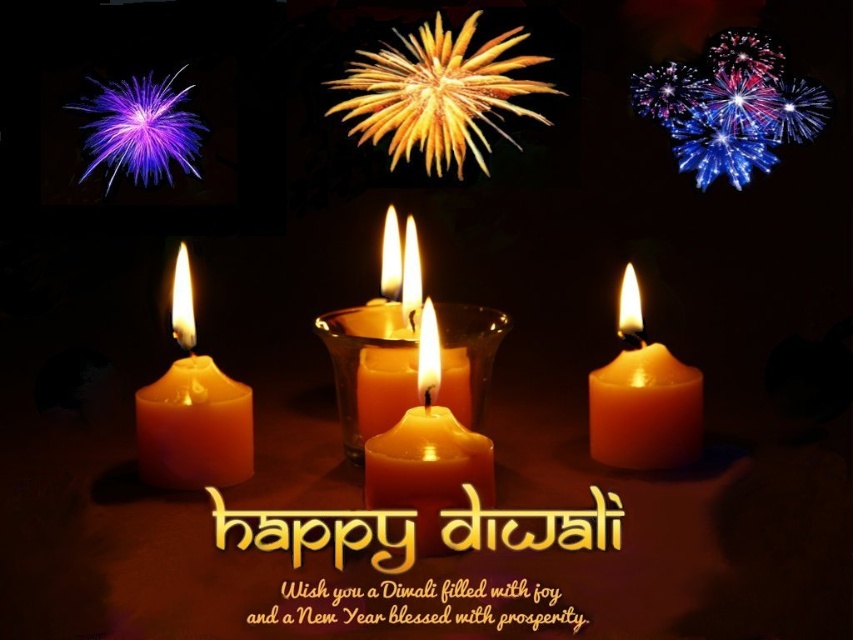
You are attending a Diwali celebration and notice two candles, the matte orange candle at lower left and the matte wax candle at center. From your perspective, which candle is positioned lower in the image?

The matte orange candle at lower left is positioned lower than the matte wax candle at center, so it is the lower one.

Looking at this image, you are holding a camera and want to capture a closeup shot of the sparkling glass fireworks at upper right. The camera requires the subject to be at least 22 inches away to focus properly. Based on the scene description, will the fireworks be in focus?

The sparkling glass fireworks at upper right is 21.81 inches away from camera, which is slightly less than the required 22 inches. Therefore, the fireworks will not be in focus.

You are planning to place a new candle on the reflective surface where the matte orange candle at lower left and the matte wax candle at center are already positioned. If you want to place the new candle so that it is taller than both existing candles, where should you place it?

The matte orange candle at lower left is taller than the matte wax candle at center. To place a new candle taller than both, it must be positioned somewhere on the reflective surface where its height exceeds the height of the matte orange candle at lower left.